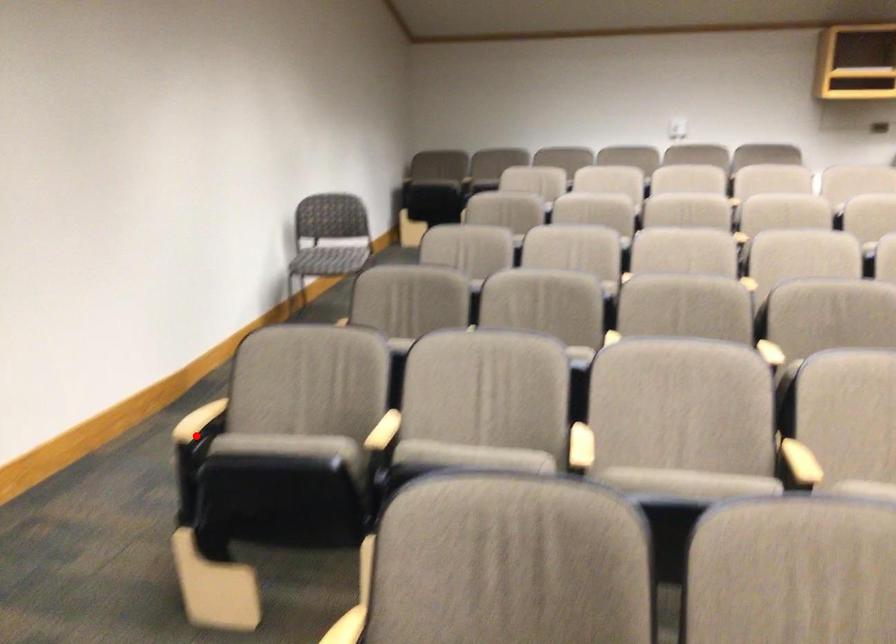
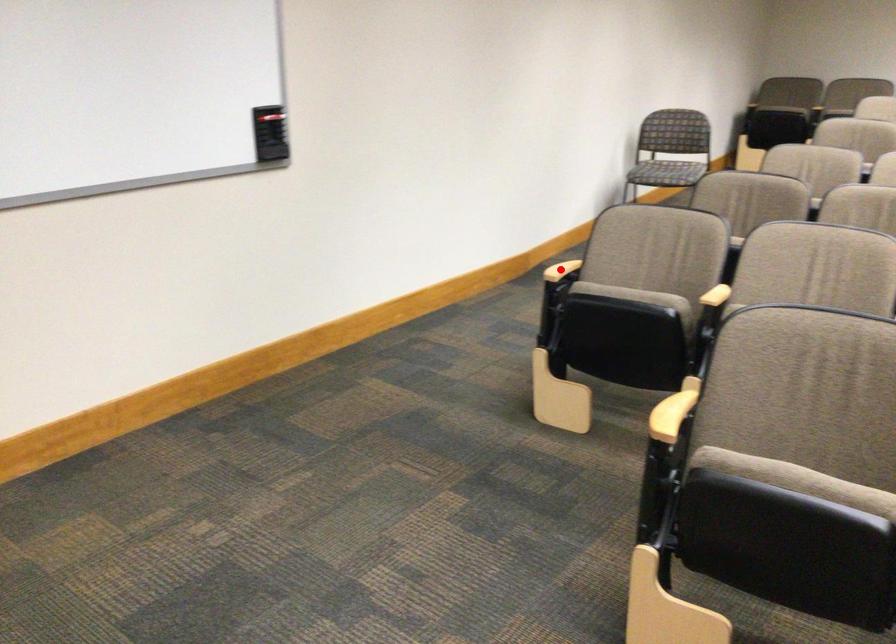
I am providing you with two images of the same scene from different viewpoints. A red point is marked on the first image and another point is marked on the second image. Does the point marked in image1 correspond to the same location as the one in image2?

Yes